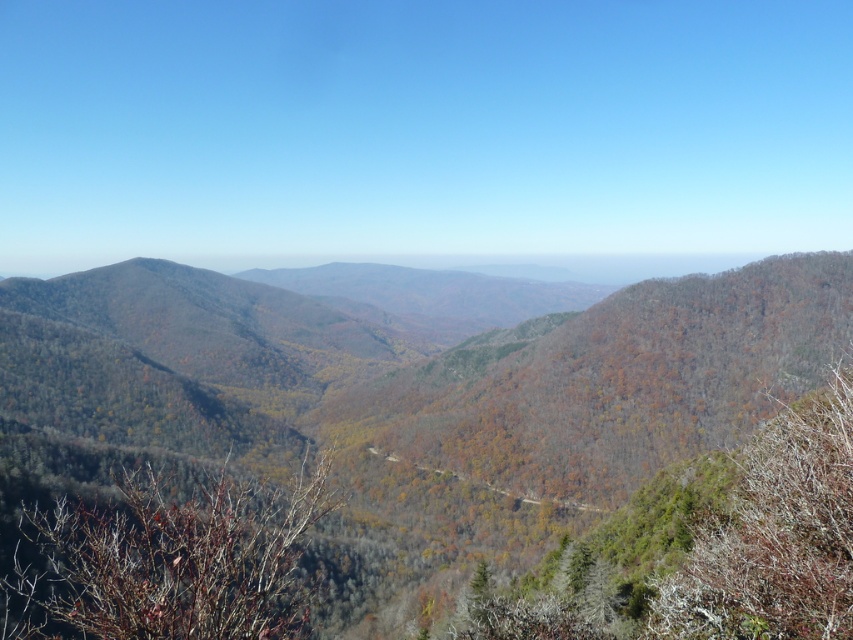
Is point (163, 492) positioned in front of point (717, 552)?

That is False.

Who is taller, brown textured tree at center or brown textured tree at right?

brown textured tree at center

Does point (305, 456) lie behind point (801, 502)?

Yes, it is behind point (801, 502).

The image size is (853, 640). I want to click on brown textured tree at center, so click(167, 561).